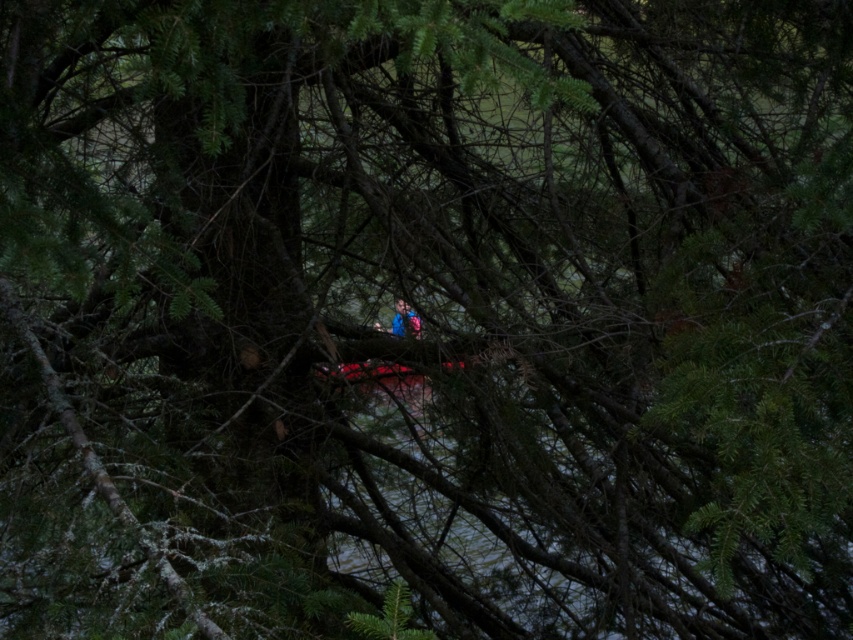
Question: Does dark red wood canoe at center appear on the left side of blue fabric at center?

Choices:
 (A) no
 (B) yes

Answer: (B)

Question: Among these objects, which one is nearest to the camera?

Choices:
 (A) dark red wood canoe at center
 (B) blue fabric at center

Answer: (B)

Question: Which object is farther from the camera taking this photo?

Choices:
 (A) blue fabric at center
 (B) dark red wood canoe at center

Answer: (B)

Question: Does dark red wood canoe at center appear on the right side of blue fabric at center?

Choices:
 (A) no
 (B) yes

Answer: (A)

Question: Which object appears farthest from the camera in this image?

Choices:
 (A) blue fabric at center
 (B) dark red wood canoe at center

Answer: (B)

Question: Can you confirm if dark red wood canoe at center is thinner than blue fabric at center?

Choices:
 (A) no
 (B) yes

Answer: (A)